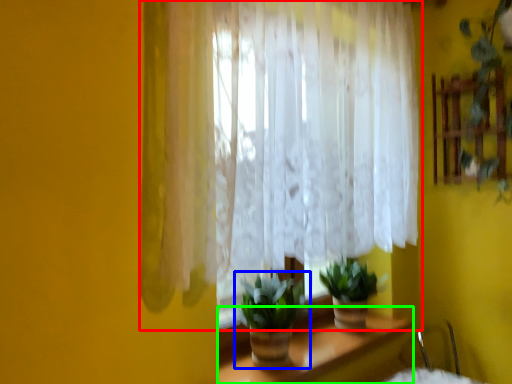
Question: Considering the real-world distances, which object is closest to curtain (highlighted by a red box)? houseplant (highlighted by a blue box) or table (highlighted by a green box).

Choices:
 (A) houseplant
 (B) table

Answer: (A)